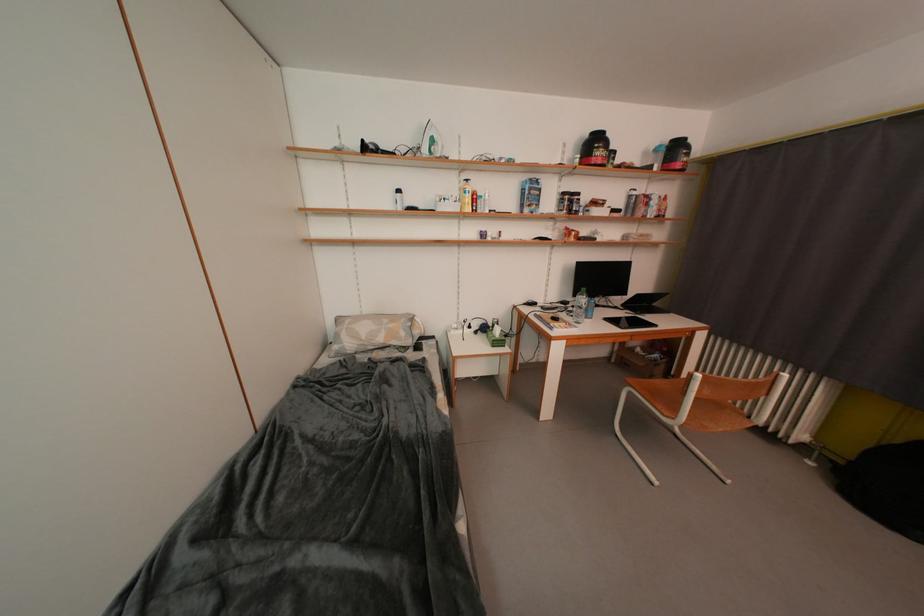
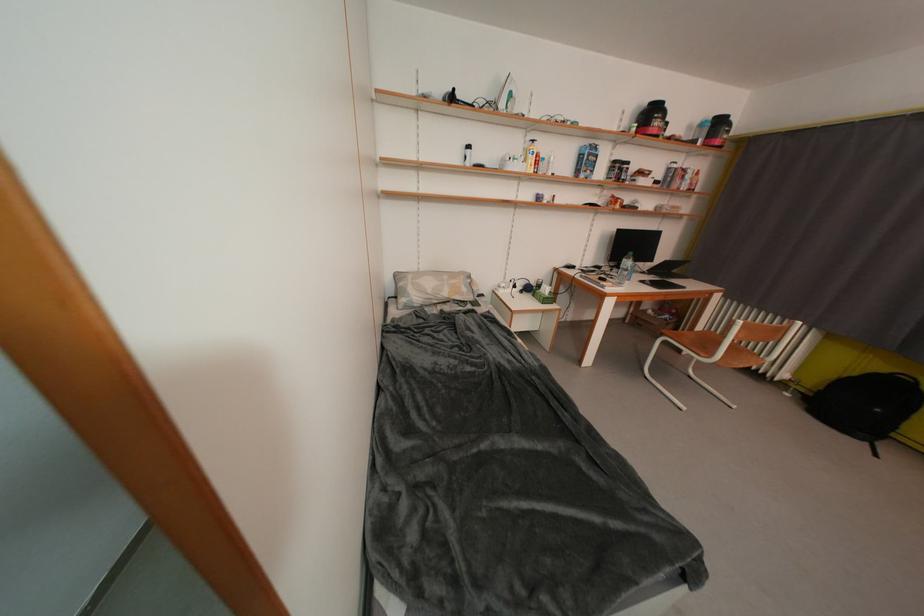
The point at (x=608, y=164) is marked in the first image. Where is the corresponding point in the second image?

(663, 136)